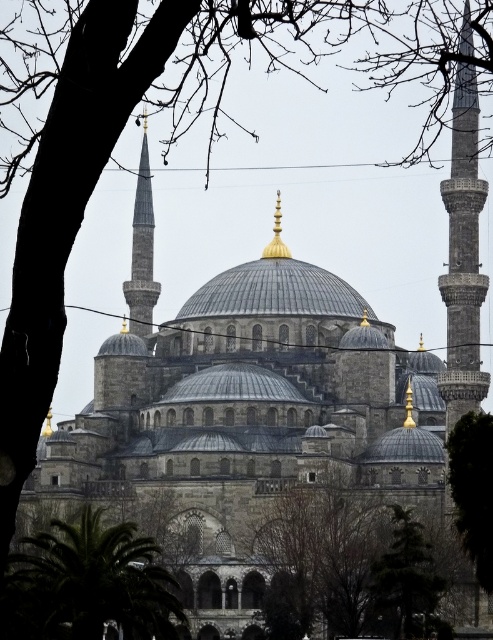
You are standing at the entrance of the Blue Mosque and want to take a photo that includes both the green leafy tree at lower left and the green leafy tree at lower right. Given that your camera has a maximum angle of view of 60 degrees, can you determine if both trees will fit in the frame without moving your position?

The green leafy tree at lower left is 63.19 feet away from green leafy tree at lower right. To determine if both trees fit in a 60 degree angle, we can use trigonometry. Assuming the distance from the camera to the trees is D, the maximum distance between the trees that can fit in the frame is 2D tan 30 degrees. However, without knowing the distance D from the camera to the trees, we cannot definitively answer if they will fit. Additional information about the distance from the camera to the trees is needed